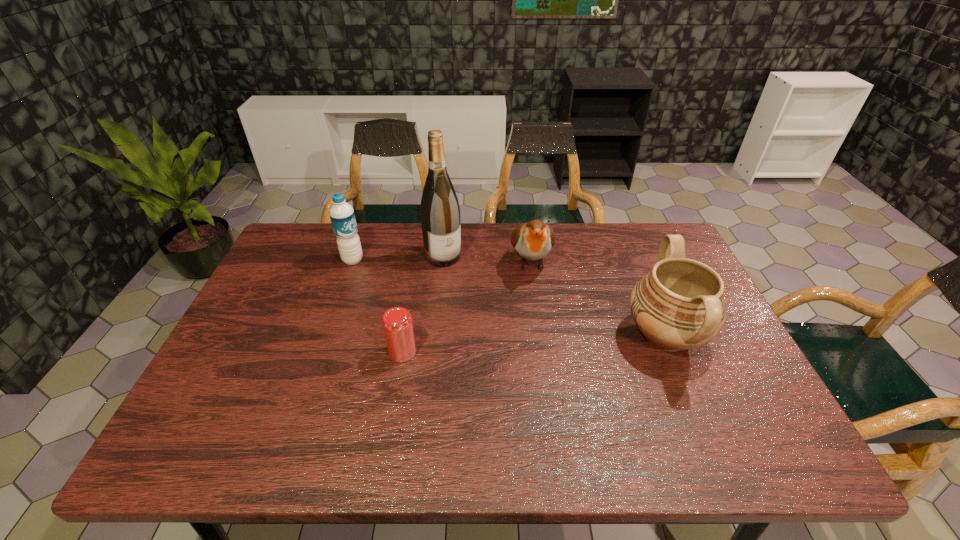
The width and height of the screenshot is (960, 540). Identify the location of vacant space on the desktop that is between the beer can and the rightmost object and is positioned on the label of the wine bottle. (514, 345).

This screenshot has height=540, width=960. What are the coordinates of `free space on the desktop that is between the shortest object and the rightmost object and is positioned on the label of the leftmost object` in the screenshot? It's located at pyautogui.click(x=498, y=346).

Identify the location of free spot on the desktop that is between the shortest object and the rightmost object and is positioned at the face of the fourth object from left to right. This screenshot has width=960, height=540. (539, 343).